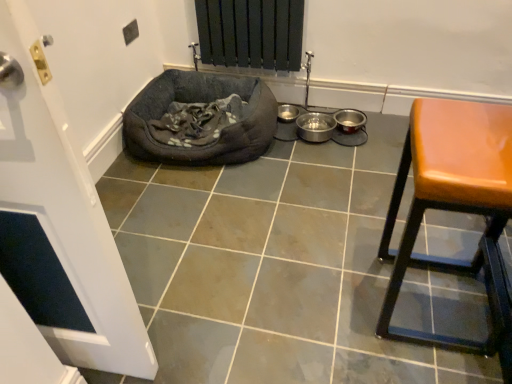
This screenshot has width=512, height=384. Find the location of `free space on the front side of dark gray fabric dog bed at lower left`. free space on the front side of dark gray fabric dog bed at lower left is located at coordinates (212, 220).